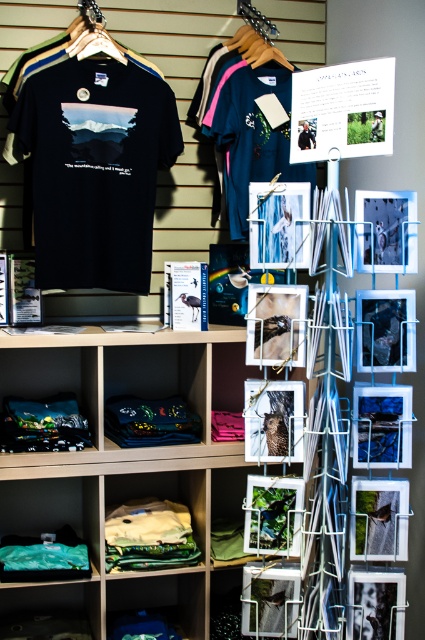
Can you confirm if wooden bookshelf at center is bigger than matte black t-shirt at center?

Indeed, wooden bookshelf at center has a larger size compared to matte black t-shirt at center.

Which is more to the right, wooden bookshelf at center or matte black t-shirt at center?

Positioned to the right is matte black t-shirt at center.

This screenshot has height=640, width=425. I want to click on wooden bookshelf at center, so point(122,461).

Is dark blue t-shirt at center to the right of matte black t-shirt at center from the viewer's perspective?

In fact, dark blue t-shirt at center is to the left of matte black t-shirt at center.

Is dark blue t-shirt at center to the left of matte black t-shirt at center from the viewer's perspective?

Yes, dark blue t-shirt at center is to the left of matte black t-shirt at center.

Between point (227, 60) and point (314, 147), which one is positioned in front?

Point (314, 147) is more forward.

This screenshot has height=640, width=425. I want to click on dark blue t-shirt at center, so click(249, 132).

Between dark blue t-shirt at center and wooden hanger at upper center, which one has more height?

With more height is dark blue t-shirt at center.

Is dark blue t-shirt at center shorter than wooden hanger at upper center?

No.

Does point (229, 113) come in front of point (260, 60)?

Yes, it is in front of point (260, 60).

You are a GUI agent. You are given a task and a screenshot of the screen. Output one action in this format:
    pyautogui.click(x=<x>, y=<y>)
    Task: Click on the dark blue t-shirt at center
    This screenshot has height=640, width=425.
    Given the screenshot: What is the action you would take?
    pyautogui.click(x=249, y=132)